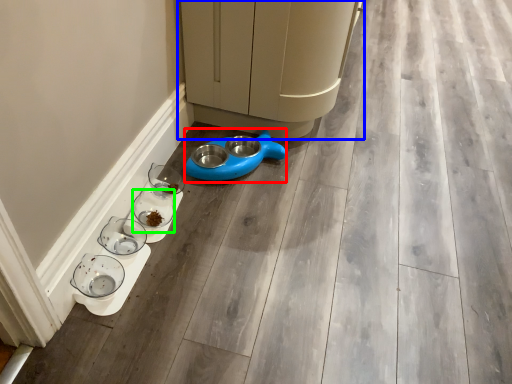
Question: Which is farther away from appliance (highlighted by a red box)? furniture (highlighted by a blue box) or glass bowl (highlighted by a green box)?

Choices:
 (A) furniture
 (B) glass bowl

Answer: (A)